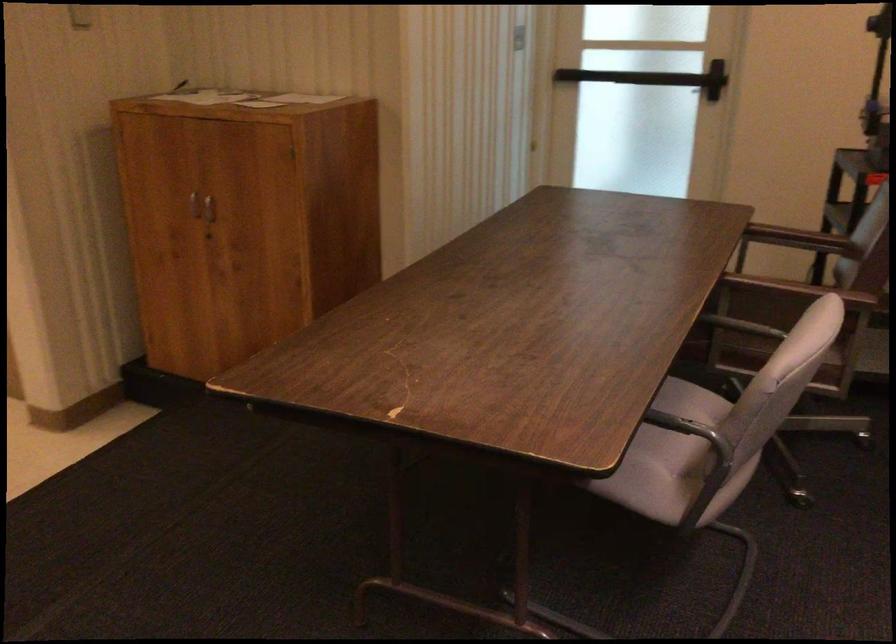
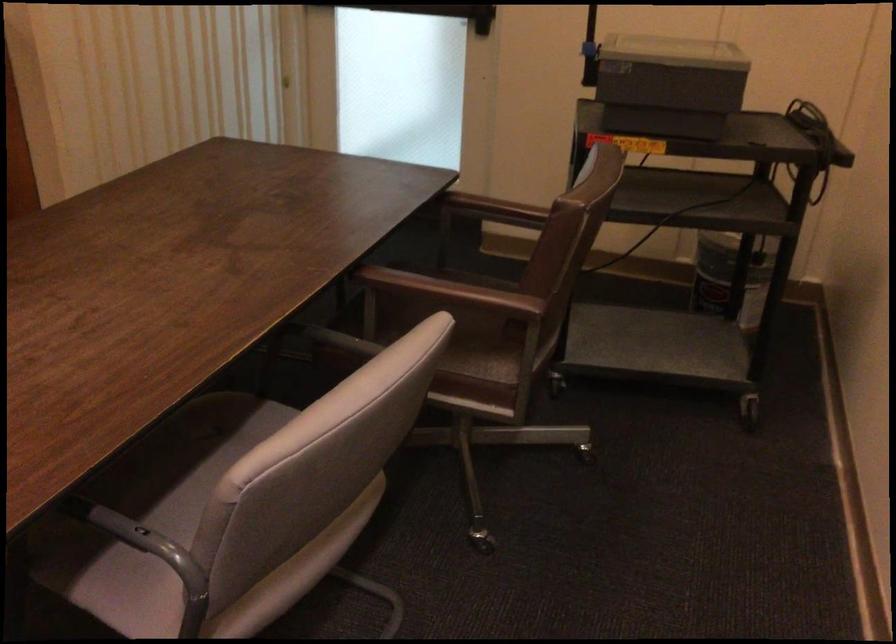
Question: I am providing you with two images of the same scene from different viewpoints. Please identify which objects are invisible in image2.

Choices:
 (A) brown chair armrest
 (B) grey chair armrest
 (C) door push bar
 (D) none of these

Answer: (D)